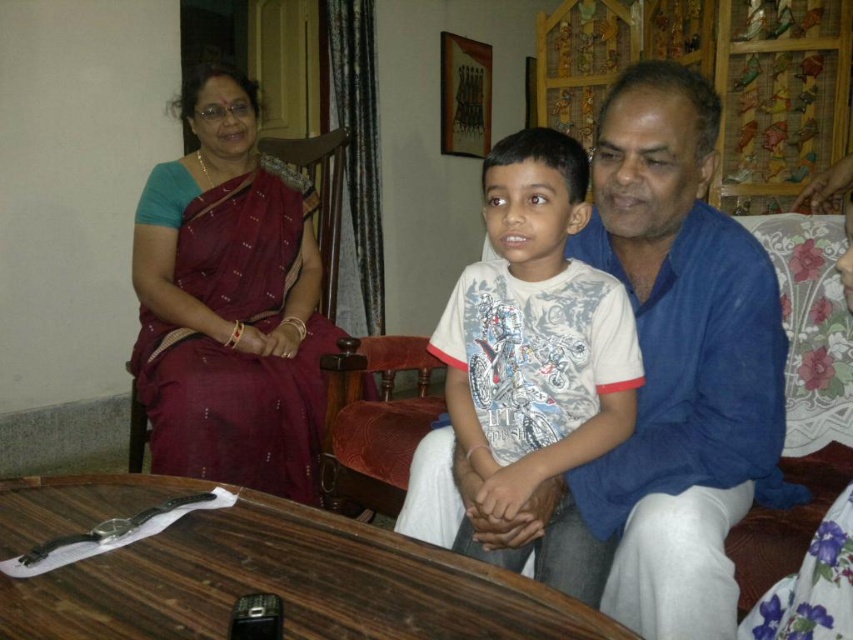
Question: Is blue cotton shirt at center positioned behind maroon silk saree at upper left?

Choices:
 (A) yes
 (B) no

Answer: (B)

Question: Estimate the real-world distances between objects in this image. Which object is farther from the maroon silk saree at upper left?

Choices:
 (A) blue cotton shirt at center
 (B) white cotton shirt at center

Answer: (A)

Question: Does blue cotton shirt at center have a larger size compared to white cotton shirt at center?

Choices:
 (A) yes
 (B) no

Answer: (A)

Question: Which point is closer to the camera?

Choices:
 (A) maroon silk saree at upper left
 (B) blue cotton shirt at center

Answer: (B)

Question: Considering the relative positions of wooden table at lower center and white cotton shirt at center in the image provided, where is wooden table at lower center located with respect to white cotton shirt at center?

Choices:
 (A) above
 (B) below

Answer: (B)

Question: Based on their relative distances, which object is farther from the maroon silk saree at upper left?

Choices:
 (A) wooden table at lower center
 (B) white cotton shirt at center
 (C) blue cotton shirt at center

Answer: (A)